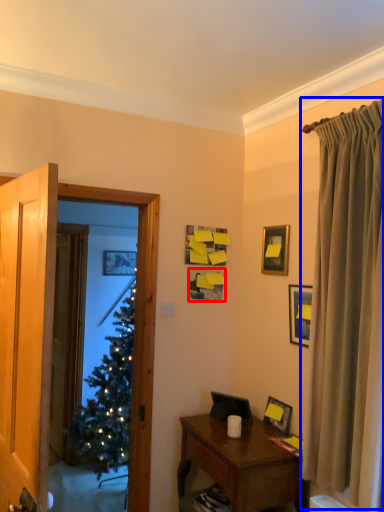
Question: Which object is further to the camera taking this photo, picture frame (highlighted by a red box) or curtain (highlighted by a blue box)?

Choices:
 (A) picture frame
 (B) curtain

Answer: (A)